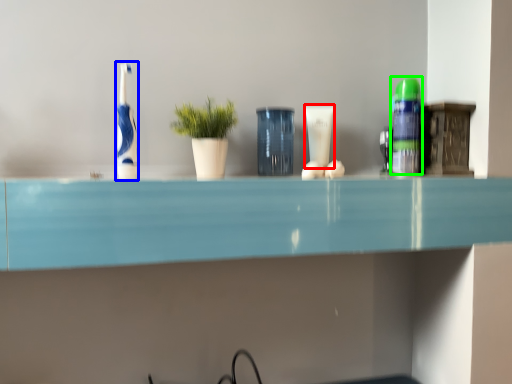
Question: Based on their relative distances, which object is farther from toiletry (highlighted by a red box)? Choose from toothbrush (highlighted by a blue box) and toiletry (highlighted by a green box).

Choices:
 (A) toothbrush
 (B) toiletry

Answer: (A)